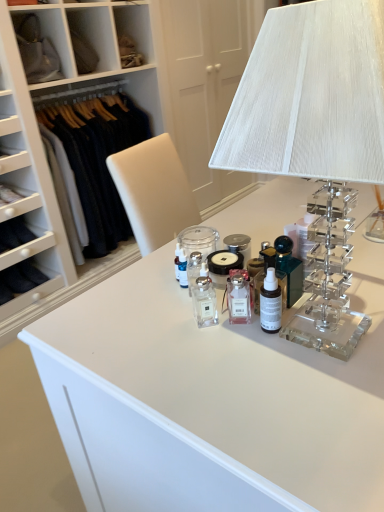
Question: From the image's perspective, is dark wool sweater at left above clear acrylic table lamp at upper right?

Choices:
 (A) yes
 (B) no

Answer: (A)

Question: Considering the relative sizes of dark wool sweater at left and clear acrylic table lamp at upper right in the image provided, is dark wool sweater at left wider than clear acrylic table lamp at upper right?

Choices:
 (A) yes
 (B) no

Answer: (A)

Question: From the image's perspective, would you say dark wool sweater at left is shown under clear acrylic table lamp at upper right?

Choices:
 (A) yes
 (B) no

Answer: (B)

Question: Is clear acrylic table lamp at upper right completely or partially inside dark wool sweater at left?

Choices:
 (A) yes
 (B) no

Answer: (B)

Question: Does dark wool sweater at left have a smaller size compared to clear acrylic table lamp at upper right?

Choices:
 (A) no
 (B) yes

Answer: (A)

Question: Is dark wool sweater at left at the left side of clear acrylic table lamp at upper right?

Choices:
 (A) yes
 (B) no

Answer: (A)

Question: From the image's perspective, is clear acrylic table lamp at upper right located beneath satin black bottle at center, which is counted as the 2th toiletry, starting from the left?

Choices:
 (A) no
 (B) yes

Answer: (A)

Question: Considering the relative sizes of clear acrylic table lamp at upper right and satin black bottle at center, the first toiletry positioned from the right, in the image provided, is clear acrylic table lamp at upper right smaller than satin black bottle at center, the first toiletry positioned from the right,?

Choices:
 (A) yes
 (B) no

Answer: (B)

Question: Is clear acrylic table lamp at upper right beside satin black bottle at center, which is counted as the 2th toiletry, starting from the left?

Choices:
 (A) no
 (B) yes

Answer: (A)

Question: Is clear acrylic table lamp at upper right looking in the opposite direction of satin black bottle at center, which is counted as the 2th toiletry, starting from the left?

Choices:
 (A) yes
 (B) no

Answer: (A)

Question: Can you confirm if clear acrylic table lamp at upper right is taller than satin black bottle at center, which is counted as the 2th toiletry, starting from the left?

Choices:
 (A) no
 (B) yes

Answer: (B)

Question: Considering the relative sizes of clear acrylic table lamp at upper right and satin black bottle at center, which is counted as the 2th toiletry, starting from the left, in the image provided, is clear acrylic table lamp at upper right bigger than satin black bottle at center, which is counted as the 2th toiletry, starting from the left,?

Choices:
 (A) yes
 (B) no

Answer: (A)

Question: Is satin black bottle at center, the first toiletry positioned from the right, facing towards clear acrylic table lamp at upper right?

Choices:
 (A) no
 (B) yes

Answer: (B)